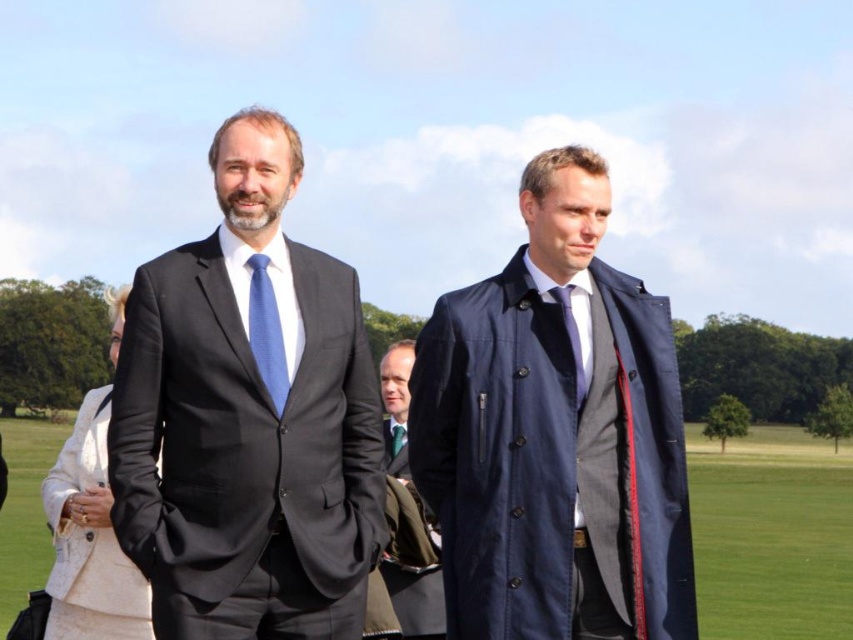
Looking at this image, between black matte suit at center and green silk tie at center, which one is positioned lower?

Positioned lower is green silk tie at center.

Does point (329, 524) come farther from viewer compared to point (399, 440)?

No, (329, 524) is closer to viewer.

Describe the element at coordinates (248, 417) in the screenshot. I see `black matte suit at center` at that location.

I want to click on black matte suit at center, so click(x=248, y=417).

Who is shorter, black matte suit at center or silky blue tie at center?

Standing shorter between the two is silky blue tie at center.

Between point (247, 365) and point (582, 397), which one is positioned behind?

The point (582, 397) is behind.

I want to click on black matte suit at center, so click(x=248, y=417).

Which of these two, white textured coat at left or silky blue tie at center, stands shorter?

silky blue tie at center is shorter.

Locate an element on the screen. white textured coat at left is located at coordinates (90, 540).

Measure the distance between point (102, 625) and camera.

Point (102, 625) is 61.36 feet away from camera.

This screenshot has height=640, width=853. Find the location of `white textured coat at left`. white textured coat at left is located at coordinates (90, 540).